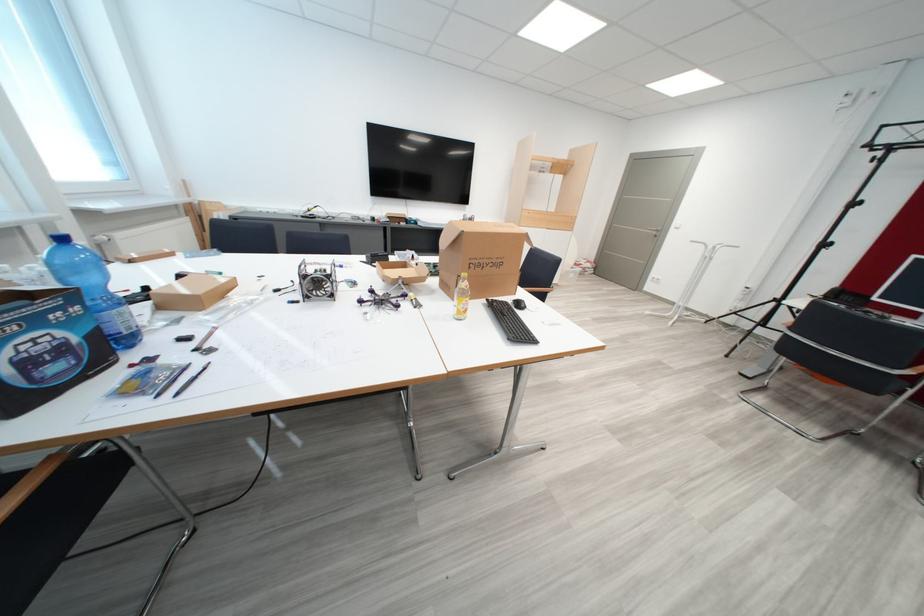
Image resolution: width=924 pixels, height=616 pixels. Describe the element at coordinates (33, 479) in the screenshot. I see `a wooden chair armrest` at that location.